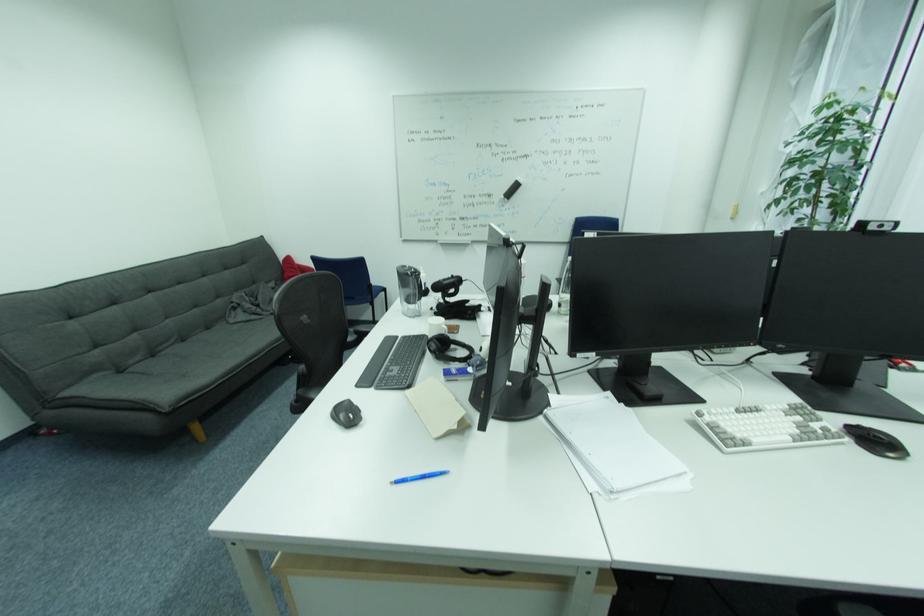
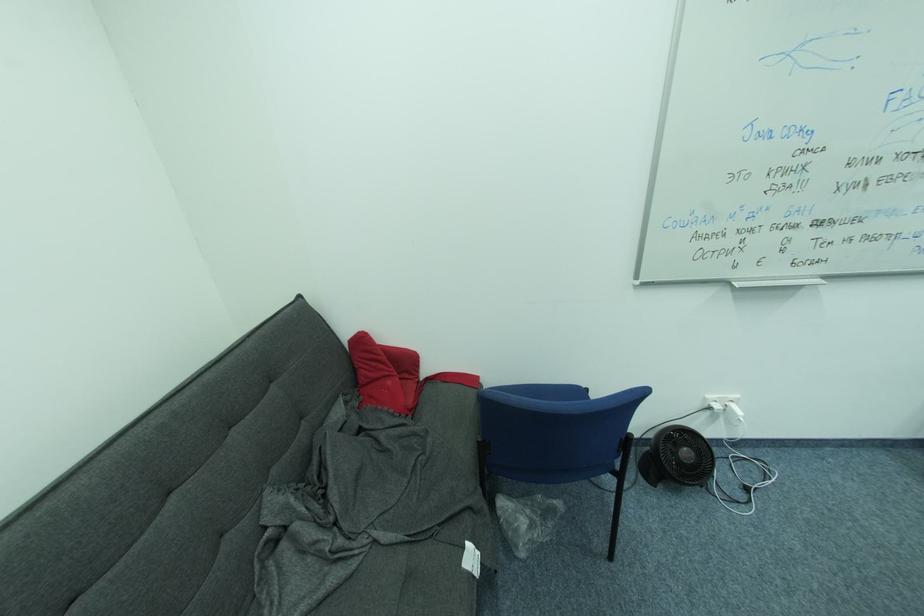
In the second image, find the point that corresponds to point 288,257 in the first image.

(353, 336)